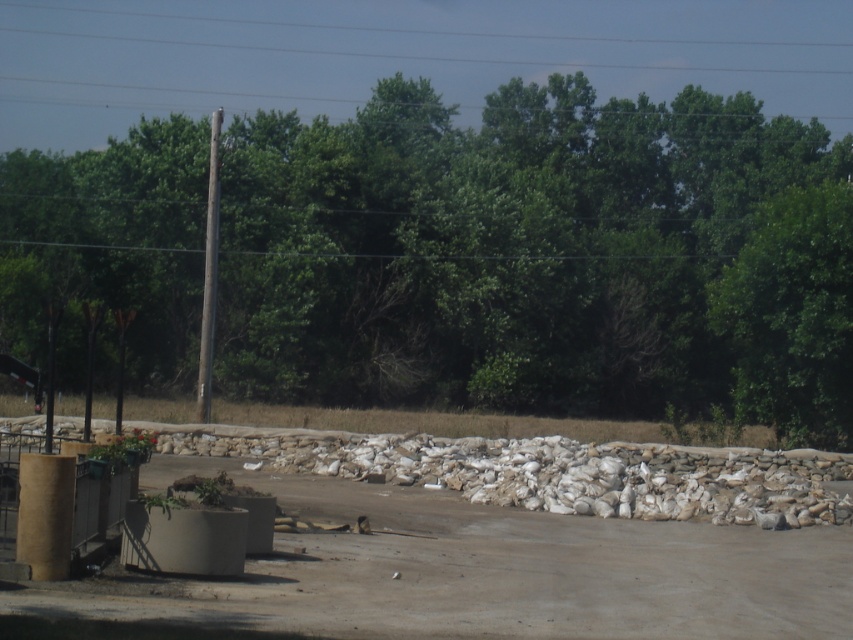
Question: Can you confirm if green leafy tree at upper center is wider than dirt track at center?

Choices:
 (A) yes
 (B) no

Answer: (A)

Question: Which of the following is the closest to the observer?

Choices:
 (A) (405, 600)
 (B) (212, 177)
 (C) (759, 256)

Answer: (A)

Question: Estimate the real-world distances between objects in this image. Which object is farther from the green leafy tree at upper center?

Choices:
 (A) dirt track at center
 (B) brown wooden pole at left

Answer: (A)

Question: Considering the real-world distances, which object is closest to the brown wooden pole at left?

Choices:
 (A) green leafy tree at upper center
 (B) dirt track at center

Answer: (B)

Question: Does dirt track at center lie in front of brown wooden pole at left?

Choices:
 (A) yes
 (B) no

Answer: (A)

Question: Is the position of dirt track at center more distant than that of brown wooden pole at left?

Choices:
 (A) no
 (B) yes

Answer: (A)